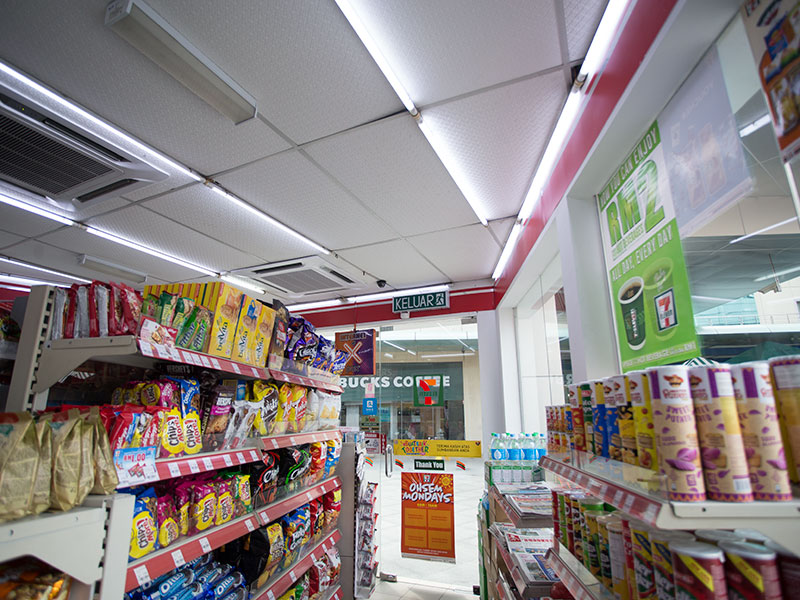
This screenshot has width=800, height=600. What are the coordinates of `coffee sign` in the screenshot? It's located at (388, 376), (409, 377), (360, 377).